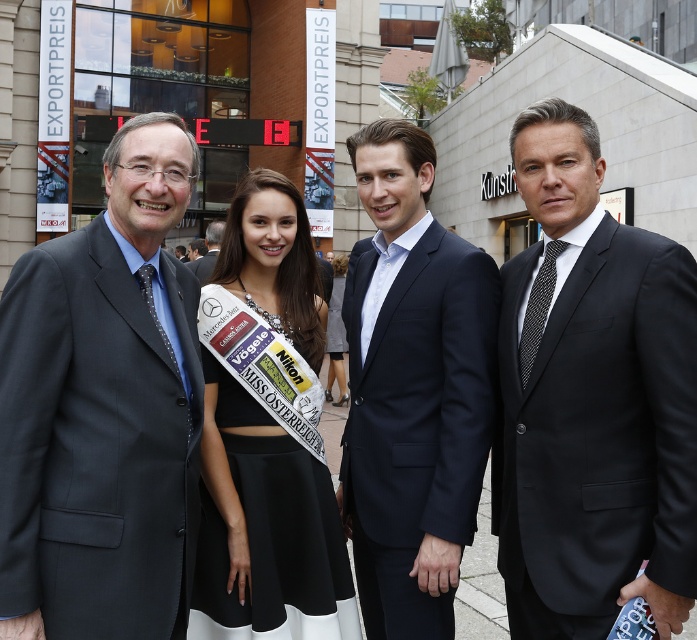
You are attending the event and need to take a photo with the navy wool suit at center and matte black suit at center. Since you want to include both in the frame, which one should you position lower in your camera viewfinder to ensure both are visible?

The navy wool suit at center is below the matte black suit at center, so you should position the navy wool suit at center lower in your camera viewfinder to ensure both are visible.

From the picture: You are a photographer at the event and need to capture a clear photo of the black satin suit at right and the white satin sash at center. Which object is closer to the camera?

The black satin suit at right is in front of the white satin sash at center, so it is closer to the camera.

You are attending the Exportpreis ceremony and need to find the tallest person wearing a dark blue suit at left and navy wool suit at center. Which one should you approach?

The dark blue suit at left is much taller than the navy wool suit at center, so you should approach the person wearing the dark blue suit at left.